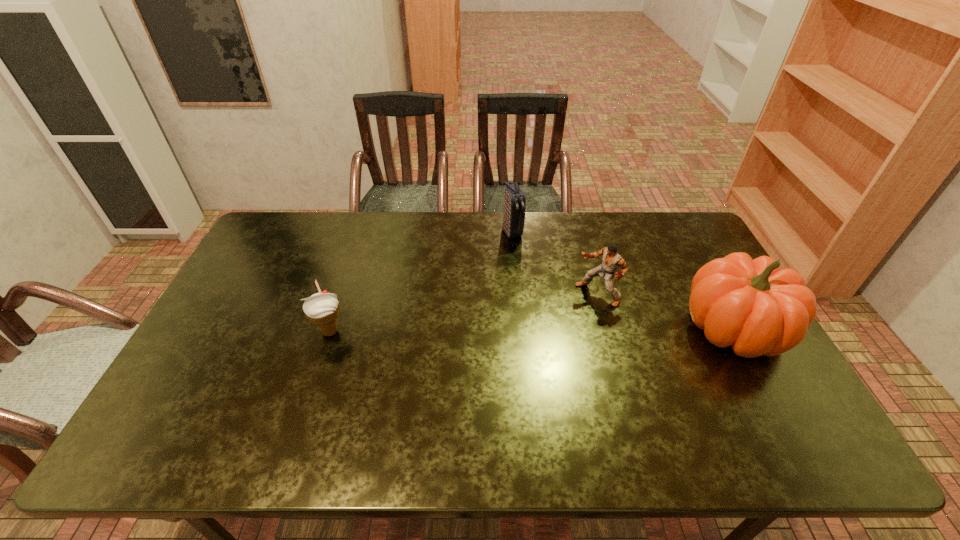
The image size is (960, 540). I want to click on vacant point located between the second object from left to right and the pumpkin, so click(x=623, y=280).

You are a GUI agent. You are given a task and a screenshot of the screen. Output one action in this format:
    pyautogui.click(x=<x>, y=<y>)
    Task: Click on the empty location between the puncher and the rightmost object
    This screenshot has width=960, height=540.
    Given the screenshot: What is the action you would take?
    pyautogui.click(x=665, y=311)

Select which object is the closest to the tallest object. Please provide its 2D coordinates. Your answer should be formatted as a tuple, i.e. [(x, y)], where the tuple contains the x and y coordinates of a point satisfying the conditions above.

[(611, 260)]

Select which object appears as the closest to the second object from right to left. Please provide its 2D coordinates. Your answer should be formatted as a tuple, i.e. [(x, y)], where the tuple contains the x and y coordinates of a point satisfying the conditions above.

[(751, 305)]

Find the location of a particular element. The height and width of the screenshot is (540, 960). vacant space that satisfies the following two spatial constraints: 1. on the back side of the farthest object; 2. on the right side of the icecream is located at coordinates (362, 232).